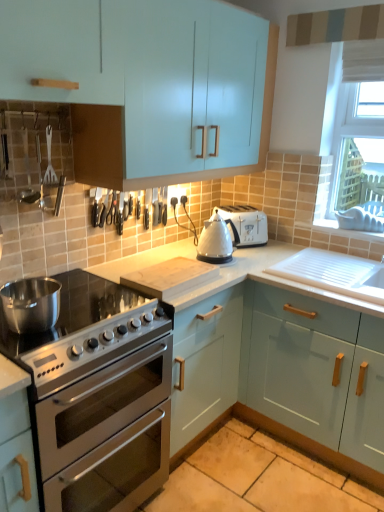
Question: In terms of width, does white plastic window screen at upper right look wider or thinner when compared to light blue glossy cabinet at upper left, the third cabinetry positioned from the bottom?

Choices:
 (A) wide
 (B) thin

Answer: (B)

Question: Is white plastic window screen at upper right in front of or behind light blue glossy cabinet at upper left, which is the first cabinetry from top to bottom, in the image?

Choices:
 (A) front
 (B) behind

Answer: (B)

Question: Which of these objects is positioned closest to the polished stainless steel pot at left?

Choices:
 (A) light blue glossy cabinet at upper left, which is the first cabinetry from top to bottom
 (B) white glossy kettle at center, which is counted as the 1th appliance, starting from the top
 (C) wooden cutting board at center, placed as the second appliance when sorted from top to bottom
 (D) stainless steel oven at lower left
 (E) matte plastic exhaust hood at upper center

Answer: (D)

Question: Considering the real-world distances, which object is farthest from the white glossy sink at lower right?

Choices:
 (A) wooden cutting board at center, placed as the second appliance when sorted from top to bottom
 (B) matte light blue cabinet at center, the second cabinetry ordered from the bottom
 (C) polished stainless steel pot at left
 (D) matte plastic exhaust hood at upper center
 (E) light blue glossy cabinet at upper left, the third cabinetry positioned from the bottom

Answer: (C)